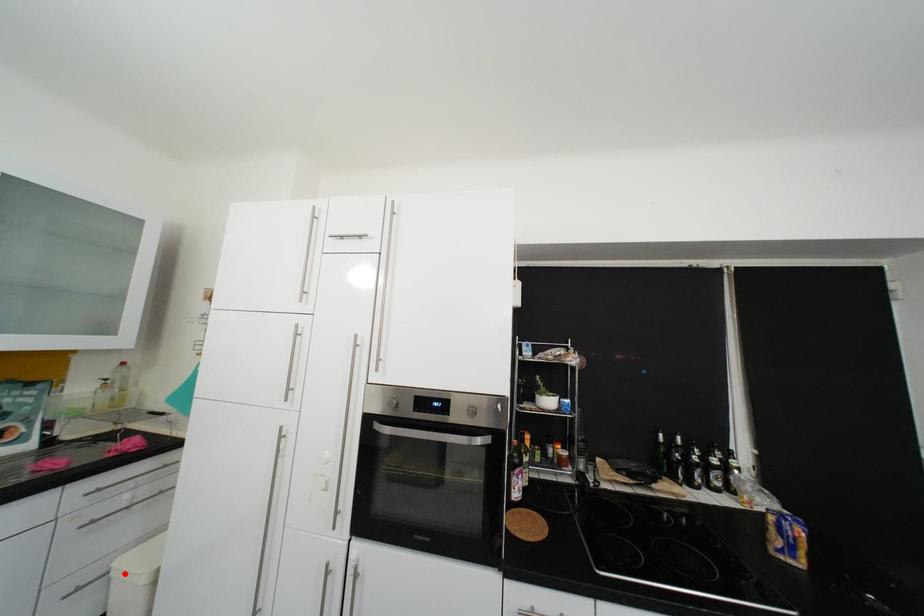
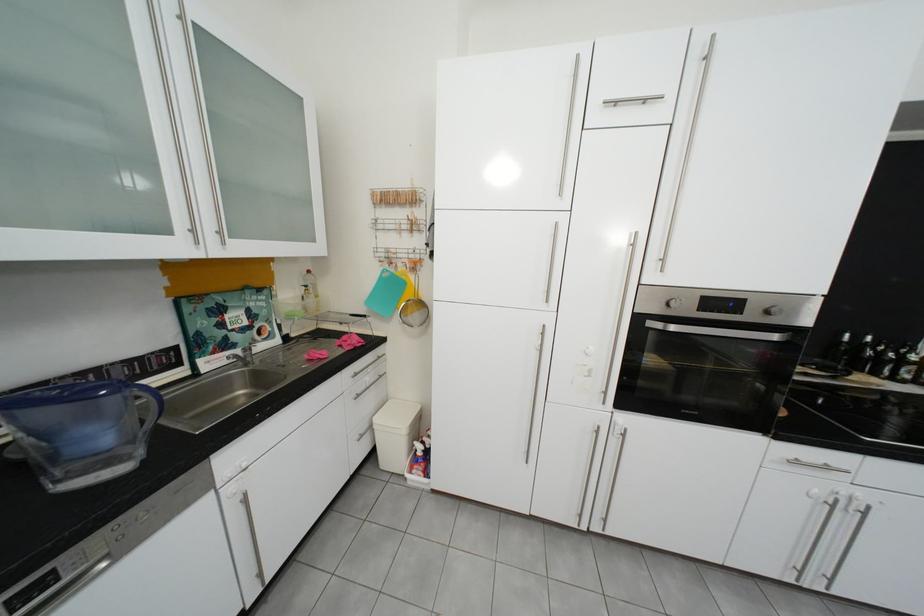
Find the pixel in the second image that matches the highlighted location in the first image.

(386, 428)